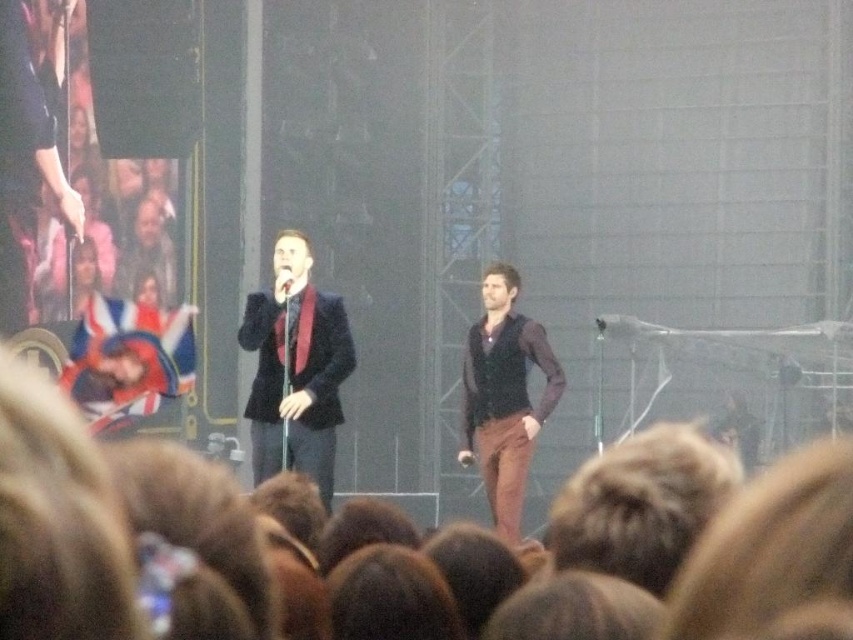
In the scene shown: You are a photographer at the concert and need to capture both the brown hair at lower center and the brown velvet vest at center in a single shot. Based on their sizes, which object should you focus on first to ensure both are in frame?

The brown hair at lower center has a smaller size compared to the brown velvet vest at center. To ensure both are in frame, focus on the larger brown velvet vest at center first, then adjust the camera angle to include the smaller brown hair at lower center.

You are a photographer at the concert. You want to take a photo of the performer on the left and the performer on the right. However, there is a point at coordinates point (641, 504) that might block your view. Is this point blocking the view between the two performers?

The point (641, 504) is on brown hair at lower center, so it is blocking the view between the performer on the left and the performer on the right.